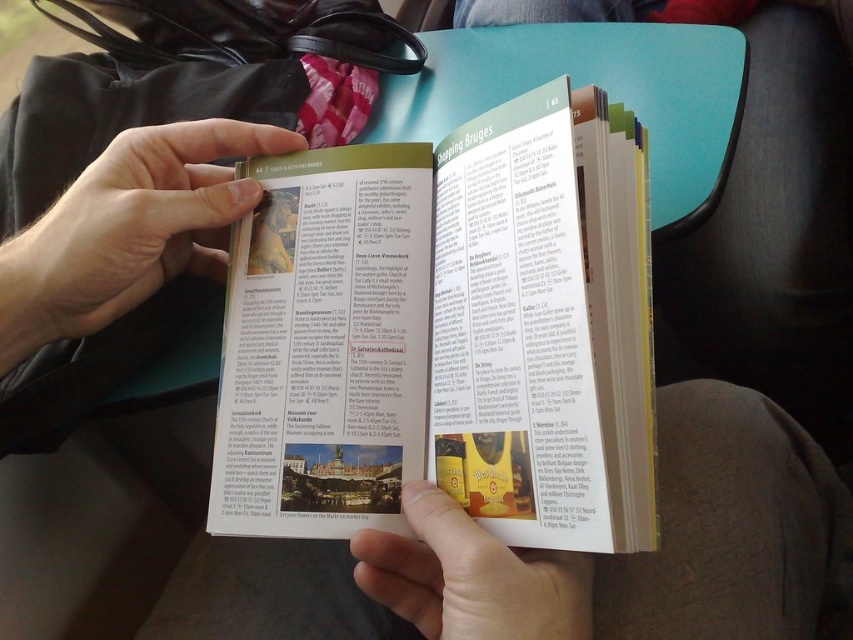
Question: Which of the following is the closest to the observer?

Choices:
 (A) paperback book at center
 (B) matte yellow paper at lower center
 (C) smooth skin hand at center

Answer: (B)

Question: Can you confirm if paperback book at center is thinner than smooth skin hand at center?

Choices:
 (A) no
 (B) yes

Answer: (A)

Question: Can you confirm if paperback book at center is wider than smooth skin hand at center?

Choices:
 (A) no
 (B) yes

Answer: (B)

Question: Estimate the real-world distances between objects in this image. Which object is farther from the paperback book at center?

Choices:
 (A) smooth skin hand at center
 (B) matte yellow paper at lower center

Answer: (A)

Question: Can you confirm if smooth skin hand at center is positioned above matte yellow paper at lower center?

Choices:
 (A) no
 (B) yes

Answer: (B)

Question: Based on their relative distances, which object is nearer to the smooth skin hand at center?

Choices:
 (A) matte yellow paper at lower center
 (B) paperback book at center

Answer: (B)